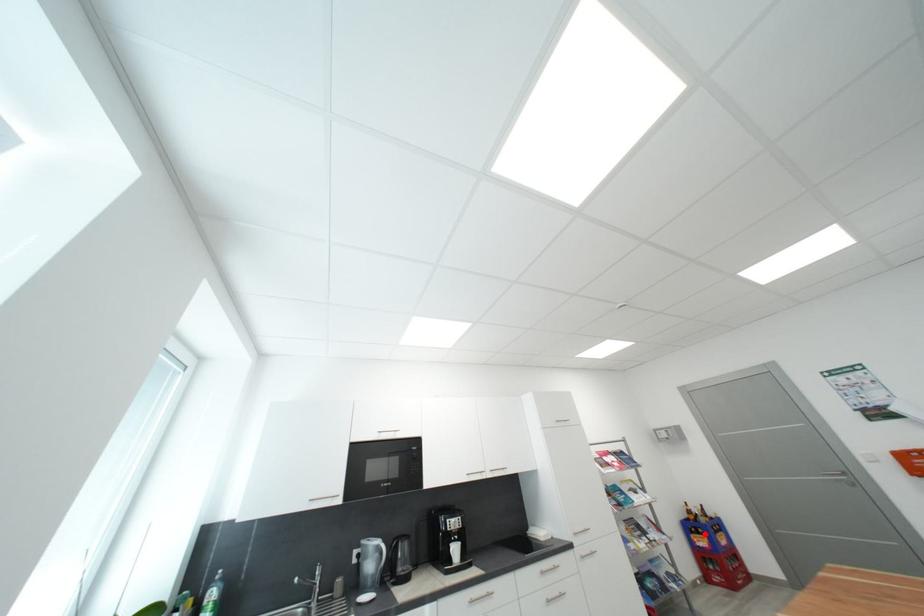
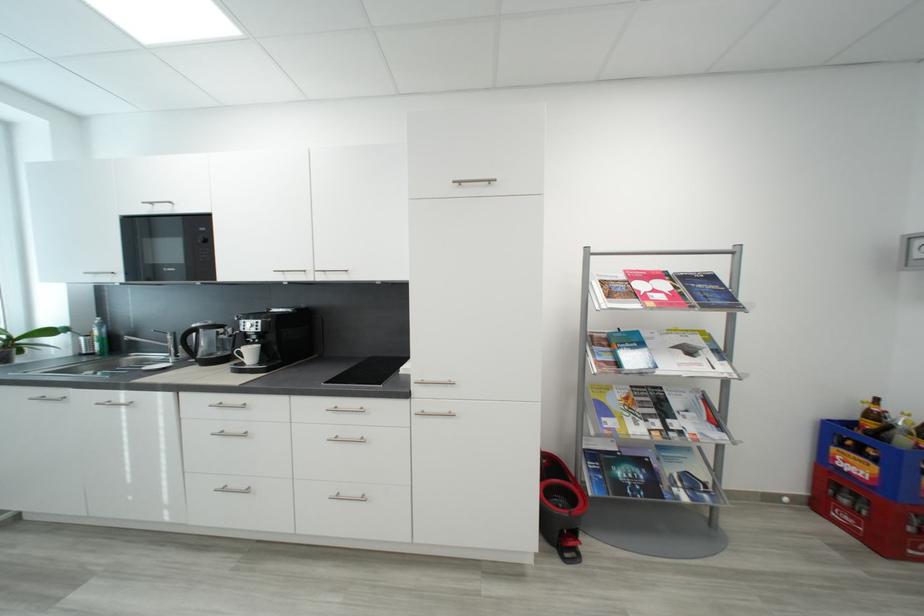
Question: I am providing you with two images of the same scene from different viewpoints. Image1 has a red point marked. In image2, the corresponding 3D location appears at what relative position? Reply with the corresponding letter.

Choices:
 (A) Closer
 (B) Farther

Answer: (A)